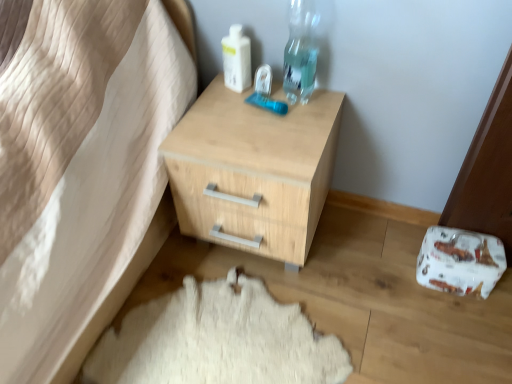
Locate an element on the screen. Image resolution: width=512 pixels, height=384 pixels. free space to the left of white plastic bottle at upper center is located at coordinates (214, 88).